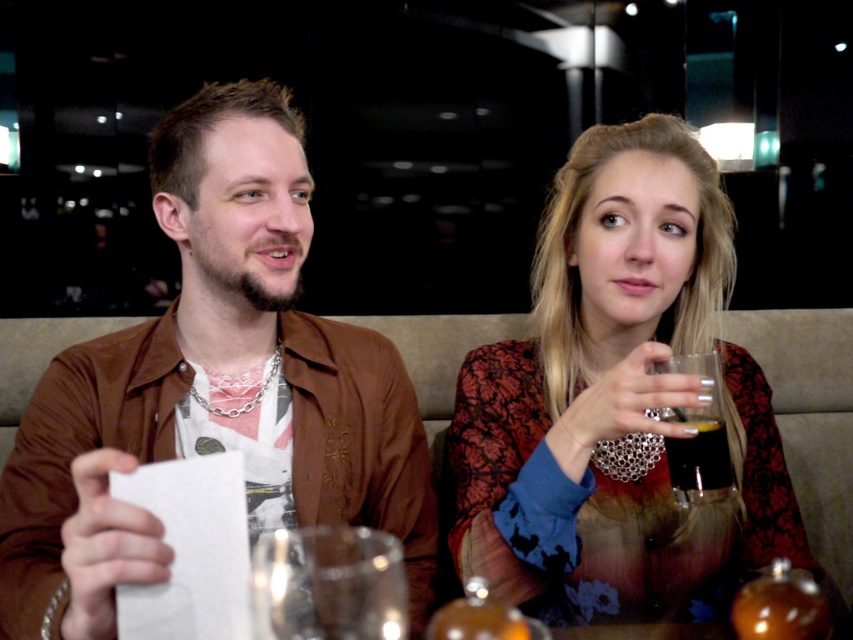
You are a fashion designer observing the scene. You notice the matte black dress at center and the transparent glass at lower center. Which object is taller?

The matte black dress at center is taller than the transparent glass at lower center.

You are a barista who needs to place the translucent glass at upper right on a shelf. The shelf can only hold items smaller than the brown leather jacket at center. Can the glass fit on the shelf?

The brown leather jacket at center is larger in size than the translucent glass at upper right, so the glass is smaller and can fit on the shelf since it is smaller than the jacket.